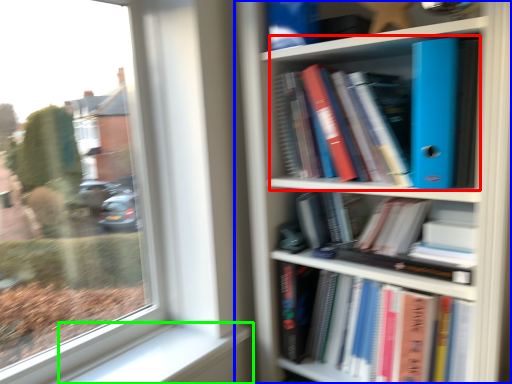
Question: Estimate the real-world distances between objects in this image. Which object is closer to book (highlighted by a red box), bookcase (highlighted by a blue box) or window sill (highlighted by a green box)?

Choices:
 (A) bookcase
 (B) window sill

Answer: (A)